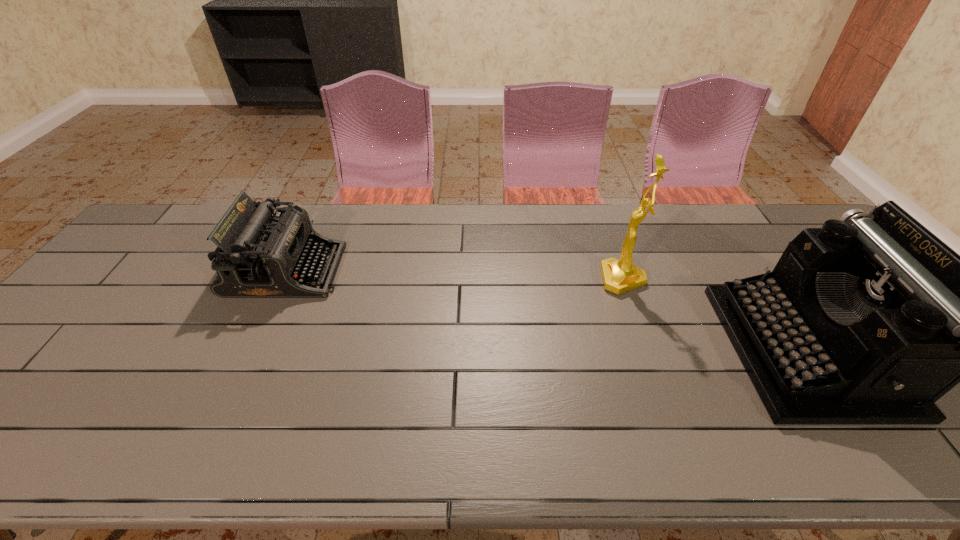
Locate an element on the screen. award is located at coordinates (619, 275).

The width and height of the screenshot is (960, 540). I want to click on the taller typewriter, so click(869, 320).

Image resolution: width=960 pixels, height=540 pixels. Identify the location of the right typewriter. (869, 320).

Image resolution: width=960 pixels, height=540 pixels. Identify the location of the shorter typewriter. (260, 255).

Identify the location of the shortest object. The height and width of the screenshot is (540, 960). (260, 255).

You are a GUI agent. You are given a task and a screenshot of the screen. Output one action in this format:
    pyautogui.click(x=<x>, y=<y>)
    Task: Click on the free spot located 0.250m on the front-facing side of the award
    
    Given the screenshot: What is the action you would take?
    pyautogui.click(x=515, y=279)

Where is `vacant space located on the front-facing side of the award`? vacant space located on the front-facing side of the award is located at coordinates (505, 279).

Locate an element on the screen. vacant space located on the front-facing side of the award is located at coordinates (470, 279).

Locate an element on the screen. This screenshot has height=540, width=960. vacant region located 0.110m on the typing side of the second shortest object is located at coordinates (690, 349).

At what (x,y) coordinates should I click in order to perform the action: click on free location located on the typing side of the second shortest object. Please return your answer as a coordinate pair (x, y). The width and height of the screenshot is (960, 540). Looking at the image, I should click on (702, 349).